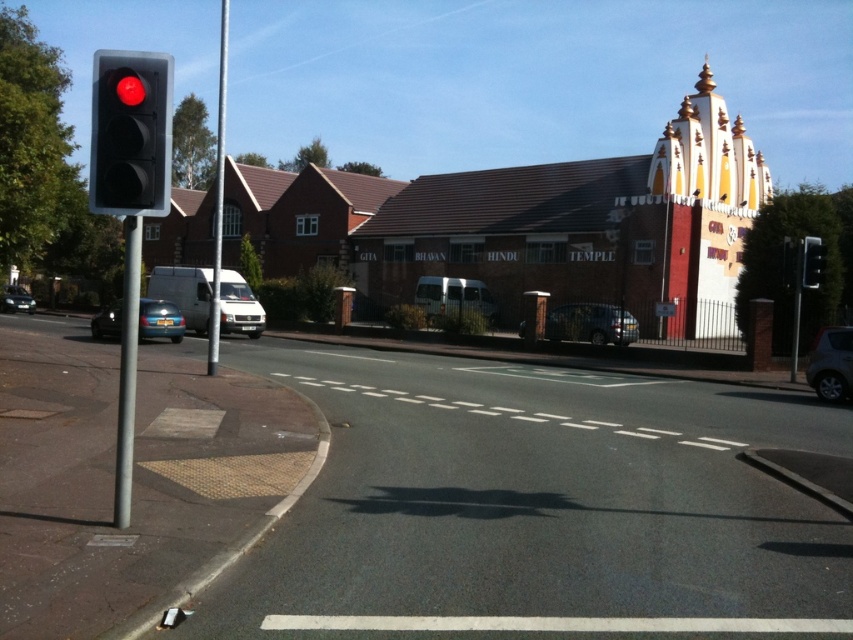
Question: Does metallic silver car at center appear on the right side of metallic silver car at left?

Choices:
 (A) yes
 (B) no

Answer: (A)

Question: Is the position of black asphalt road at center less distant than that of metallic silver car at left?

Choices:
 (A) yes
 (B) no

Answer: (A)

Question: Which point is farther to the camera?

Choices:
 (A) (604, 304)
 (B) (128, 237)
 (C) (428, 403)

Answer: (A)

Question: Does black plastic traffic light at left appear over white plastic sign at center?

Choices:
 (A) yes
 (B) no

Answer: (A)

Question: Which of the following is the farthest from the observer?

Choices:
 (A) (218, 330)
 (B) (572, 316)
 (C) (126, 284)

Answer: (B)

Question: Which point is farther from the camera taking this photo?

Choices:
 (A) (822, 412)
 (B) (569, 332)
 (C) (25, 294)
 (D) (799, 257)

Answer: (C)